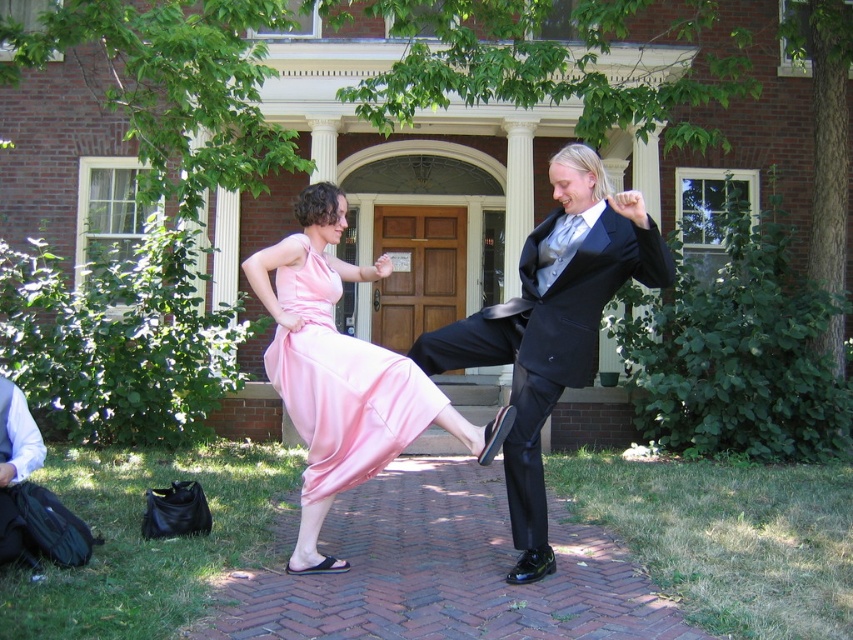
Question: Is shiny black suit at center smaller than satin pink dress at center?

Choices:
 (A) yes
 (B) no

Answer: (B)

Question: Among these objects, which one is farthest from the camera?

Choices:
 (A) satin pink dress at center
 (B) pink satin dress at center

Answer: (B)

Question: Among these objects, which one is farthest from the camera?

Choices:
 (A) pink satin dress at center
 (B) shiny black suit at center
 (C) satin pink dress at center

Answer: (A)

Question: Is satin pink dress at center below pink satin dress at center?

Choices:
 (A) no
 (B) yes

Answer: (B)

Question: Is shiny black suit at center above pink satin dress at center?

Choices:
 (A) yes
 (B) no

Answer: (A)

Question: Which of the following is the closest to the observer?

Choices:
 (A) pink satin dress at center
 (B) shiny black suit at center
 (C) satin pink dress at center

Answer: (B)